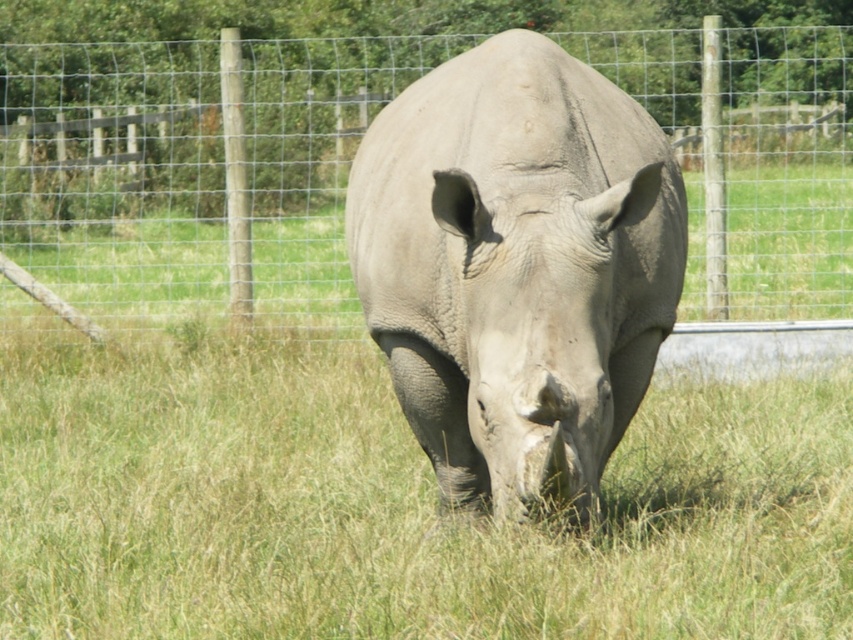
You are standing at the center of the field where the rhinoceros is grazing. You notice a point marked at coordinates [194,170]. What object is located at that point?

The point at [194,170] indicates the wire mesh fence at center.

You are a wildlife photographer trying to capture a clear photo of the gray matte rhinoceros at center. However, there is a wire mesh fence at center blocking your view. Can you move to the right side of the rhinoceros to get an unobstructed shot?

The wire mesh fence at center is to the left of the gray matte rhinoceros at center, so moving to the right side of the rhinoceros would allow you to avoid the fence and get an unobstructed shot.